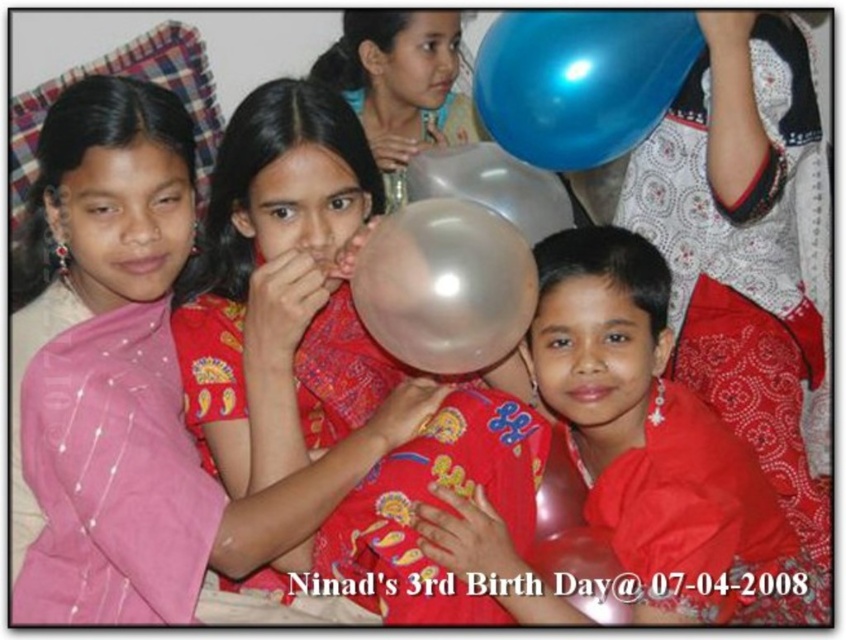
Question: Which point appears closest to the camera in this image?

Choices:
 (A) (389, 234)
 (B) (486, 200)
 (C) (680, 22)

Answer: (A)

Question: Can you confirm if shiny red balloon at center is positioned below translucent rubber balloon at center?

Choices:
 (A) no
 (B) yes

Answer: (B)

Question: Can you confirm if shiny blue balloon at upper right is positioned above transparent plastic balloon at center?

Choices:
 (A) no
 (B) yes

Answer: (B)

Question: Can you confirm if shiny red balloon at center is smaller than transparent plastic balloon at center?

Choices:
 (A) yes
 (B) no

Answer: (B)

Question: Considering the real-world distances, which object is farthest from the translucent rubber balloon at center?

Choices:
 (A) translucent plastic balloon at center
 (B) shiny red balloon at center
 (C) transparent plastic balloon at center
 (D) shiny blue balloon at upper right

Answer: (B)

Question: Which point is farther to the camera?

Choices:
 (A) transparent plastic balloon at center
 (B) shiny blue balloon at upper right
 (C) translucent plastic balloon at center

Answer: (B)